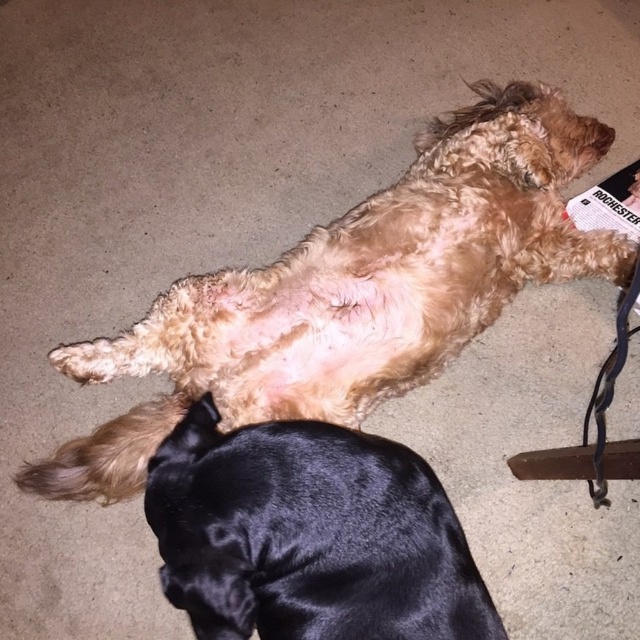
Question: Among these points, which one is nearest to the camera?

Choices:
 (A) (241, 472)
 (B) (145, 422)

Answer: (A)

Question: Does fuzzy brown dog at center have a larger size compared to black silky dog at lower center?

Choices:
 (A) no
 (B) yes

Answer: (B)

Question: Can you confirm if fuzzy brown dog at center is positioned to the right of black silky dog at lower center?

Choices:
 (A) no
 (B) yes

Answer: (B)

Question: Is fuzzy brown dog at center further to the viewer compared to black silky dog at lower center?

Choices:
 (A) no
 (B) yes

Answer: (B)

Question: Which object is closer to the camera taking this photo?

Choices:
 (A) fuzzy brown dog at center
 (B) black silky dog at lower center

Answer: (B)